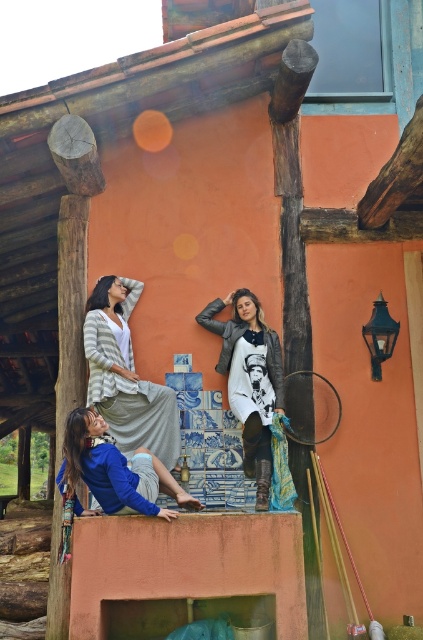
Is striped knit cardigan at upper center to the right of leather jacket at center from the viewer's perspective?

No, striped knit cardigan at upper center is not to the right of leather jacket at center.

Is striped knit cardigan at upper center closer to camera compared to leather jacket at center?

No, striped knit cardigan at upper center is behind leather jacket at center.

Does point (139, 436) come farther from viewer compared to point (258, 364)?

No.

Locate an element on the screen. The width and height of the screenshot is (423, 640). striped knit cardigan at upper center is located at coordinates (126, 376).

Between leather jacket at center and blue cotton shirt at lower left, which one is positioned higher?

leather jacket at center

Can you confirm if leather jacket at center is positioned to the right of blue cotton shirt at lower left?

Correct, you'll find leather jacket at center to the right of blue cotton shirt at lower left.

Locate an element on the screen. Image resolution: width=423 pixels, height=640 pixels. leather jacket at center is located at coordinates (249, 380).

From the picture: Can you confirm if striped knit cardigan at upper center is bigger than blue cotton shirt at lower left?

Yes.

Is point (175, 458) farther from viewer compared to point (76, 515)?

Yes, it is.

At what (x,y) coordinates should I click in order to perform the action: click on striped knit cardigan at upper center. Please return your answer as a coordinate pair (x, y). Looking at the image, I should click on (126, 376).